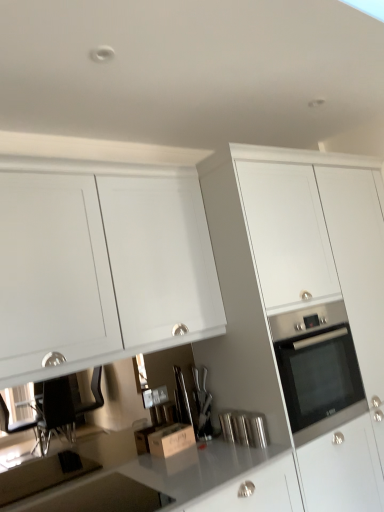
Question: Does polished stainless steel canister at center, positioned as the 2th appliance in back-to-front order, turn towards satin silver knife block at center, the second appliance from the right?

Choices:
 (A) no
 (B) yes

Answer: (A)

Question: Is polished stainless steel canister at center, which ranks as the 1th appliance in front-to-back order, bigger than satin silver knife block at center, marked as the second appliance in a front-to-back arrangement?

Choices:
 (A) no
 (B) yes

Answer: (A)

Question: Is polished stainless steel canister at center, positioned as the 2th appliance in back-to-front order, not within satin silver knife block at center, marked as the second appliance in a front-to-back arrangement?

Choices:
 (A) yes
 (B) no

Answer: (A)

Question: Is polished stainless steel canister at center, positioned as the 2th appliance in back-to-front order, closer to camera compared to satin silver knife block at center, marked as the second appliance in a front-to-back arrangement?

Choices:
 (A) no
 (B) yes

Answer: (B)

Question: Is polished stainless steel canister at center, positioned as the 2th appliance in back-to-front order, turned away from satin silver knife block at center, marked as the second appliance in a front-to-back arrangement?

Choices:
 (A) no
 (B) yes

Answer: (B)

Question: Is polished stainless steel canister at center, positioned as the 2th appliance in back-to-front order, in front of or behind white glossy cabinet at center, the 1th cabinetry when ordered from right to left, in the image?

Choices:
 (A) behind
 (B) front

Answer: (A)

Question: Is polished stainless steel canister at center, which appears as the 1th appliance when viewed from the right, wider or thinner than white glossy cabinet at center, the 1th cabinetry when ordered from right to left?

Choices:
 (A) wide
 (B) thin

Answer: (B)

Question: Which is correct: polished stainless steel canister at center, which appears as the 1th appliance when viewed from the right, is inside white glossy cabinet at center, which is counted as the second cabinetry, starting from the left, or outside of it?

Choices:
 (A) inside
 (B) outside

Answer: (A)

Question: Considering the relative positions of polished stainless steel canister at center, the second appliance from the left, and white glossy cabinet at center, the 1th cabinetry when ordered from right to left, in the image provided, is polished stainless steel canister at center, the second appliance from the left, to the left or to the right of white glossy cabinet at center, the 1th cabinetry when ordered from right to left,?

Choices:
 (A) right
 (B) left

Answer: (B)

Question: In terms of width, does wooden cardboard box at center look wider or thinner when compared to white matte cabinet at upper left, the first cabinetry from the left?

Choices:
 (A) wide
 (B) thin

Answer: (B)

Question: From the image's perspective, is wooden cardboard box at center above or below white matte cabinet at upper left, acting as the second cabinetry starting from the right?

Choices:
 (A) above
 (B) below

Answer: (B)

Question: From a real-world perspective, is wooden cardboard box at center physically located above or below white matte cabinet at upper left, acting as the second cabinetry starting from the right?

Choices:
 (A) below
 (B) above

Answer: (A)

Question: Considering their positions, is wooden cardboard box at center located in front of or behind white matte cabinet at upper left, acting as the second cabinetry starting from the right?

Choices:
 (A) front
 (B) behind

Answer: (B)

Question: From a real-world perspective, is polished stainless steel canister at center, which ranks as the 1th appliance in front-to-back order, positioned above or below satin silver knife block at center, which is counted as the 1th appliance, starting from the back?

Choices:
 (A) above
 (B) below

Answer: (B)

Question: Would you say polished stainless steel canister at center, which appears as the 1th appliance when viewed from the right, is inside or outside satin silver knife block at center, the second appliance from the right?

Choices:
 (A) inside
 (B) outside

Answer: (B)